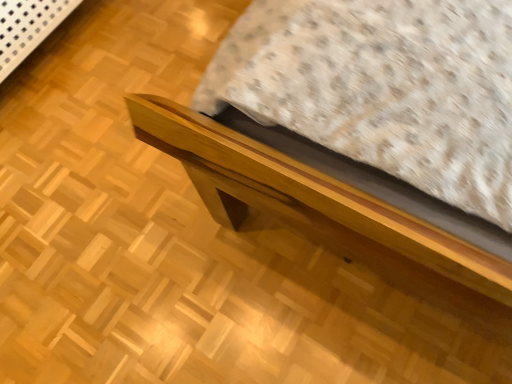
Question: Should I look upward or downward to see matte wood bed frame at center?

Choices:
 (A) down
 (B) up

Answer: (B)